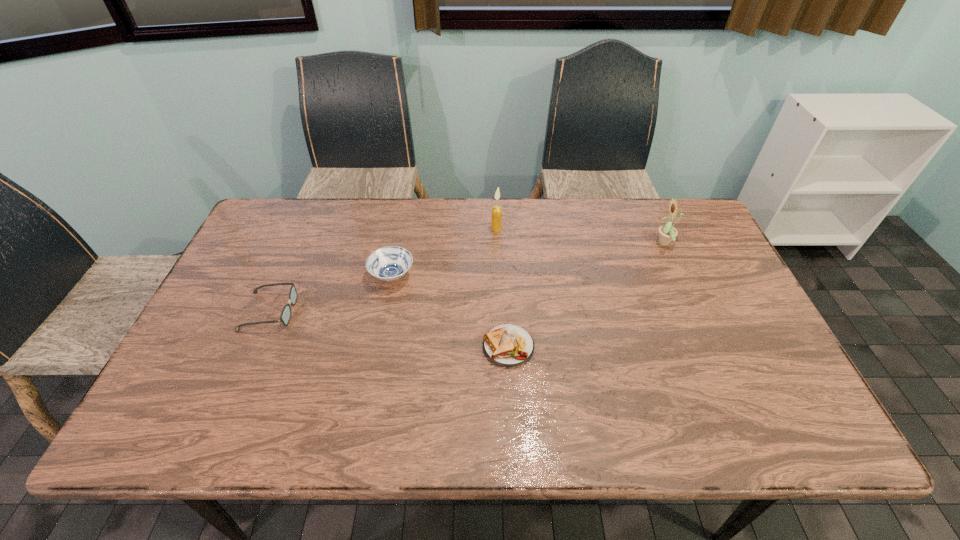
Image resolution: width=960 pixels, height=540 pixels. Identify the location of vacant area that satisfies the following two spatial constraints: 1. on the back side of the farthest object; 2. on the left side of the fourth object from right to left. (401, 229).